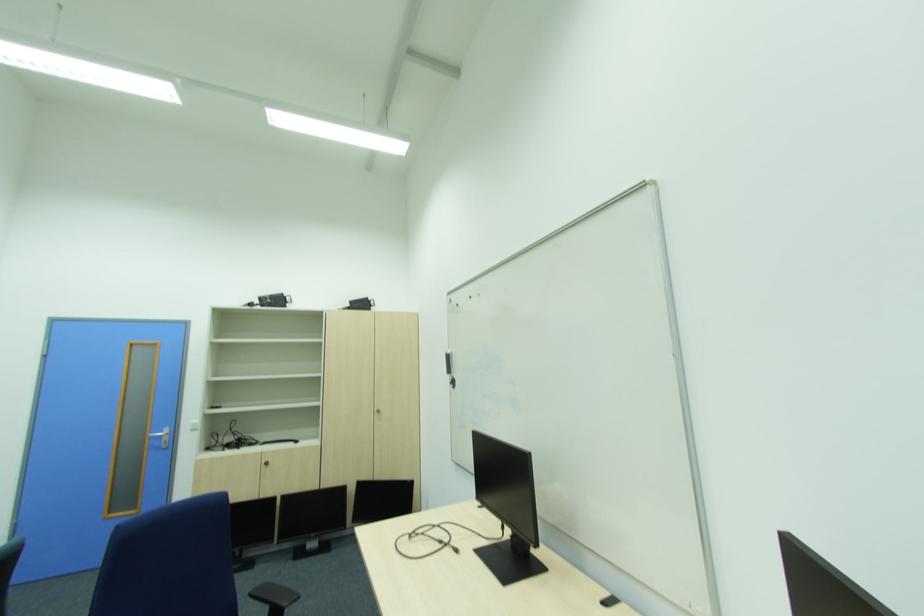
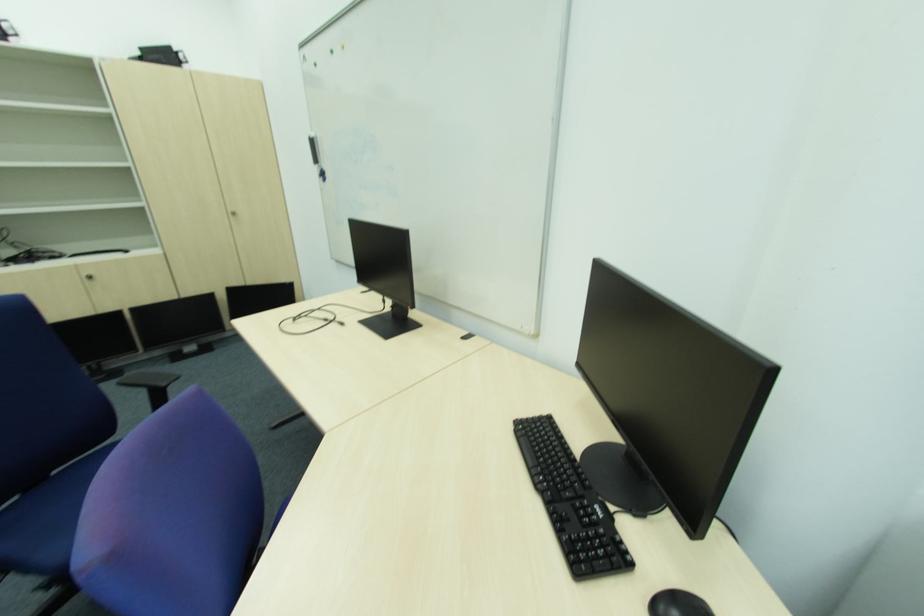
Based on the continuous images, in which direction is the camera rotating?

The rotation direction of the camera is right-down.